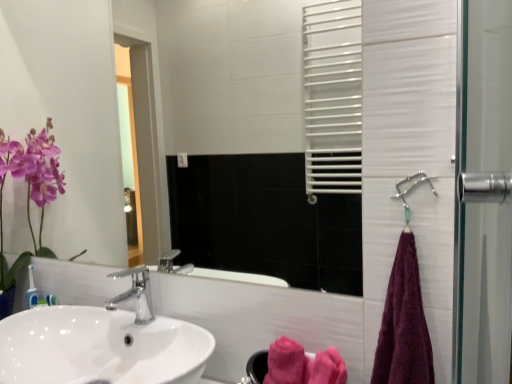
Question: Is polished chrome faucet at center positioned beyond the bounds of white glossy sink at lower left?

Choices:
 (A) yes
 (B) no

Answer: (A)

Question: Can you confirm if polished chrome faucet at center is wider than white glossy sink at lower left?

Choices:
 (A) yes
 (B) no

Answer: (B)

Question: Is polished chrome faucet at center positioned with its back to white glossy sink at lower left?

Choices:
 (A) yes
 (B) no

Answer: (B)

Question: Is polished chrome faucet at center taller than white glossy sink at lower left?

Choices:
 (A) yes
 (B) no

Answer: (B)

Question: Would you say polished chrome faucet at center contains white glossy sink at lower left?

Choices:
 (A) yes
 (B) no

Answer: (B)

Question: From a real-world perspective, is metallic silver shower at right physically located above or below white glossy mirror at upper center?

Choices:
 (A) above
 (B) below

Answer: (B)

Question: Is metallic silver shower at right bigger or smaller than white glossy mirror at upper center?

Choices:
 (A) big
 (B) small

Answer: (B)

Question: In terms of width, does metallic silver shower at right look wider or thinner when compared to white glossy mirror at upper center?

Choices:
 (A) wide
 (B) thin

Answer: (B)

Question: Does point (417, 175) appear closer or farther from the camera than point (190, 64)?

Choices:
 (A) farther
 (B) closer

Answer: (B)

Question: From a real-world perspective, relative to purple cotton towel at right, which appears as the first bath towel when viewed from the right, is white glossy sink at lower left vertically above or below?

Choices:
 (A) below
 (B) above

Answer: (A)

Question: Is white glossy sink at lower left situated inside purple cotton towel at right, placed as the 1th bath towel when sorted from front to back, or outside?

Choices:
 (A) inside
 (B) outside

Answer: (B)

Question: In the image, is white glossy sink at lower left positioned in front of or behind purple cotton towel at right, which appears as the first bath towel when viewed from the right?

Choices:
 (A) front
 (B) behind

Answer: (A)

Question: Does point (136, 374) appear closer or farther from the camera than point (399, 362)?

Choices:
 (A) closer
 (B) farther

Answer: (B)

Question: Considering the positions of pink fluffy bath towel at lower center, which is the first bath towel in left-to-right order, and polished chrome faucet at center in the image, is pink fluffy bath towel at lower center, which is the first bath towel in left-to-right order, wider or thinner than polished chrome faucet at center?

Choices:
 (A) thin
 (B) wide

Answer: (A)

Question: In the image, is pink fluffy bath towel at lower center, the 1th bath towel when ordered from back to front, positioned in front of or behind polished chrome faucet at center?

Choices:
 (A) behind
 (B) front

Answer: (B)